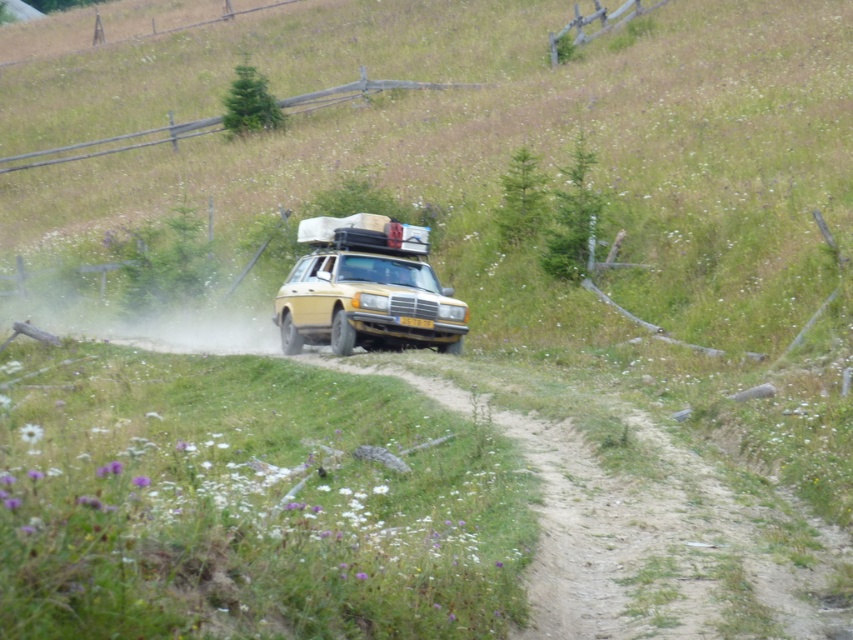
Question: Considering the relative positions of yellow matte/solid car at center and yellow plastic license plate at center in the image provided, where is yellow matte/solid car at center located with respect to yellow plastic license plate at center?

Choices:
 (A) below
 (B) above

Answer: (B)

Question: Is yellow matte/solid car at center wider than yellow plastic license plate at center?

Choices:
 (A) yes
 (B) no

Answer: (A)

Question: Which of the following is the farthest from the observer?

Choices:
 (A) (401, 260)
 (B) (399, 321)

Answer: (A)

Question: Does yellow matte/solid car at center appear under yellow plastic license plate at center?

Choices:
 (A) no
 (B) yes

Answer: (A)

Question: Among these points, which one is farthest from the camera?

Choices:
 (A) (424, 237)
 (B) (415, 321)

Answer: (A)